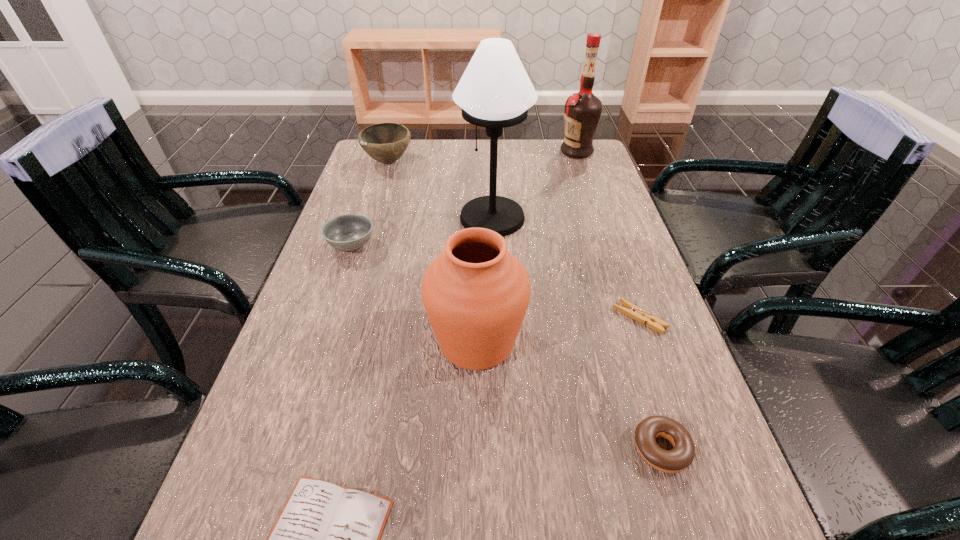
The width and height of the screenshot is (960, 540). In order to click on liquor at the right edge in this screenshot , I will do `click(582, 112)`.

The image size is (960, 540). In order to click on doughnut that is at the right edge in this screenshot , I will do `click(676, 460)`.

You are a GUI agent. You are given a task and a screenshot of the screen. Output one action in this format:
    pyautogui.click(x=<x>, y=<y>)
    Task: Click on the clothespin that is at the right edge
    
    Given the screenshot: What is the action you would take?
    pyautogui.click(x=632, y=311)

At what (x,y) coordinates should I click in order to perform the action: click on object situated at the far left corner. Please return your answer as a coordinate pair (x, y). Looking at the image, I should click on (386, 142).

This screenshot has height=540, width=960. What are the coordinates of `object that is at the far right corner` in the screenshot? It's located at (582, 112).

At what (x,y) coordinates should I click in order to perform the action: click on blank space at the far edge of the desktop. Please return your answer as a coordinate pair (x, y). Looking at the image, I should click on (508, 159).

Image resolution: width=960 pixels, height=540 pixels. I want to click on vacant space at the left edge of the desktop, so click(379, 260).

Find the location of a particular element. vacant point at the right edge is located at coordinates (588, 194).

In the image, there is a desktop. Where is `free space at the far right corner`? free space at the far right corner is located at coordinates (554, 168).

I want to click on vacant point located between the tallest object and the farther bowl, so click(x=441, y=190).